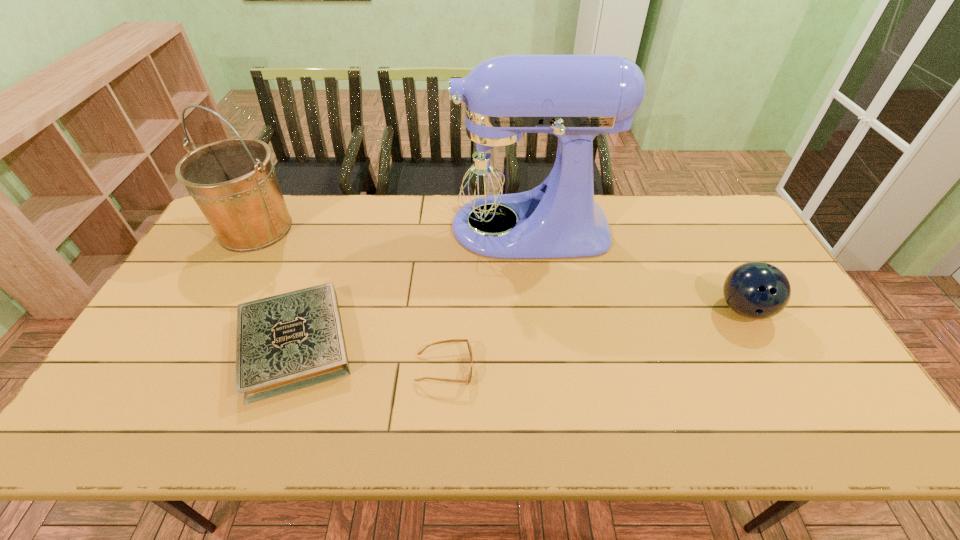
Find the location of a particular element. The height and width of the screenshot is (540, 960). unoccupied position between the sunglasses and the third shortest object is located at coordinates (594, 339).

You are a GUI agent. You are given a task and a screenshot of the screen. Output one action in this format:
    pyautogui.click(x=<x>, y=<y>)
    Task: Click on the vacant area between the fourth shortest object and the hardback book
    This screenshot has height=540, width=960.
    Given the screenshot: What is the action you would take?
    pyautogui.click(x=276, y=286)

Image resolution: width=960 pixels, height=540 pixels. What are the coordinates of `object that stands as the second closest to the bowling ball` in the screenshot? It's located at (468, 380).

The height and width of the screenshot is (540, 960). I want to click on object that is the closest to the rightmost object, so click(x=494, y=168).

What are the coordinates of `free space in the image that satisfies the following two spatial constraints: 1. on the front side of the fourth shortest object; 2. on the right side of the hardback book` in the screenshot? It's located at (193, 344).